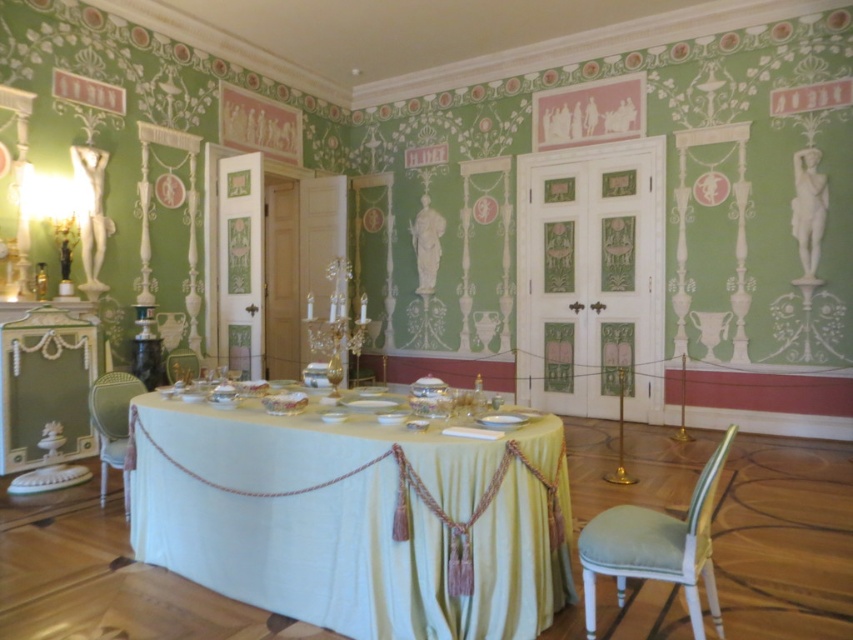
Question: In this image, where is white silk table at center located relative to metallic gold chair at lower left?

Choices:
 (A) above
 (B) below

Answer: (B)

Question: Among these points, which one is farthest from the camera?

Choices:
 (A) (115, 392)
 (B) (183, 360)

Answer: (B)

Question: Which point appears farthest from the camera in this image?

Choices:
 (A) (186, 381)
 (B) (195, 577)
 (C) (123, 410)

Answer: (A)

Question: Can you confirm if light green fabric chair at lower right is positioned below metallic gold chair at lower left?

Choices:
 (A) yes
 (B) no

Answer: (A)

Question: Is the position of white silk table at center more distant than that of light green fabric chair at lower left?

Choices:
 (A) yes
 (B) no

Answer: (B)

Question: Which object appears closest to the camera in this image?

Choices:
 (A) light green fabric chair at lower left
 (B) white silk table at center

Answer: (B)